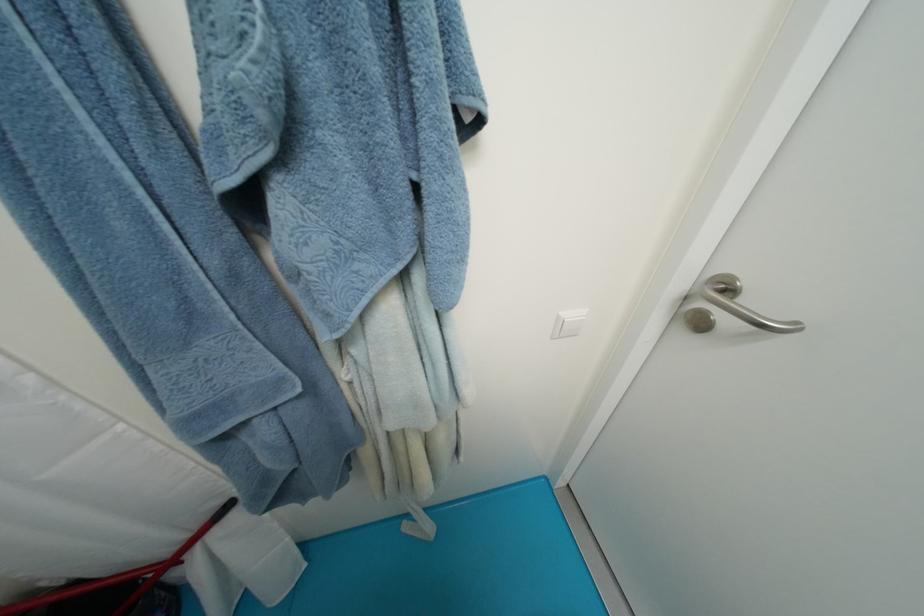
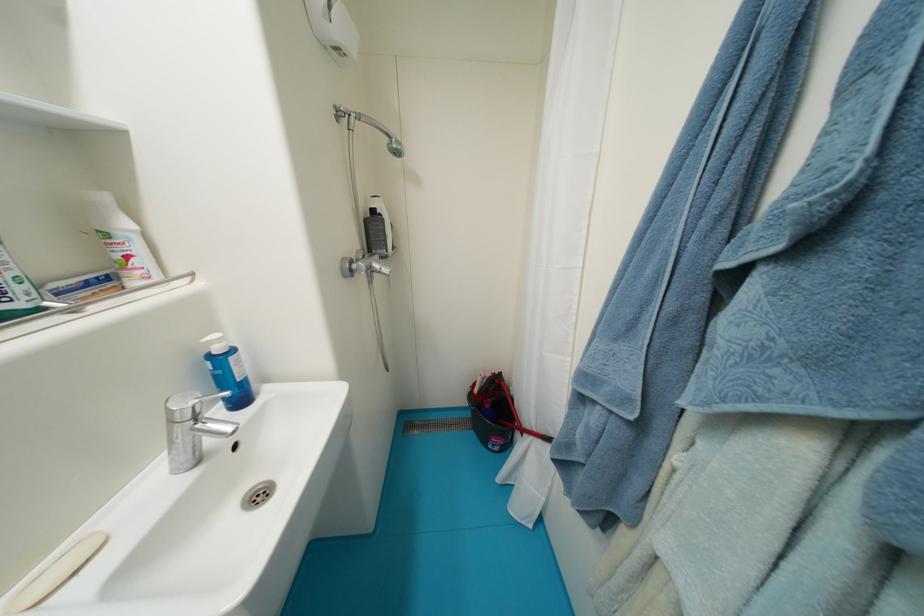
Where in the second image is the point corresponding to pixel 51 585 from the first image?

(517, 390)